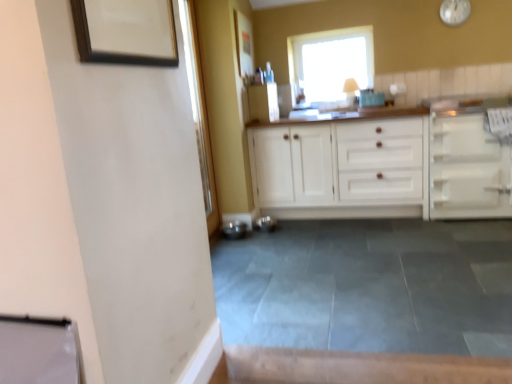
Question: From a real-world perspective, relative to white wood cabinet at center, which is the first cabinetry from left to right, is white glossy clock at upper right vertically above or below?

Choices:
 (A) below
 (B) above

Answer: (B)

Question: Considering the positions of point (439, 6) and point (309, 139), is point (439, 6) closer or farther from the camera than point (309, 139)?

Choices:
 (A) closer
 (B) farther

Answer: (B)

Question: Estimate the real-world distances between objects in this image. Which object is farther from the white matte cabinet at right, the 1th cabinetry from the right?

Choices:
 (A) white glossy clock at upper right
 (B) wooden picture frame at upper left, positioned as the second picture frame in top-to-bottom order
 (C) transparent glass window at upper center
 (D) matte wooden picture frame at upper center, arranged as the 1th picture frame when viewed from the top
 (E) gray tile floor at center

Answer: (B)

Question: Which is farther from the gray tile floor at center?

Choices:
 (A) white glossy clock at upper right
 (B) white matte cabinet at right, which is the 2th cabinetry in left-to-right order
 (C) white wood cabinet at center, which is the first cabinetry from left to right
 (D) matte wooden picture frame at upper center, placed as the second picture frame when sorted from front to back
 (E) wooden picture frame at upper left, positioned as the first picture frame in left-to-right order

Answer: (A)